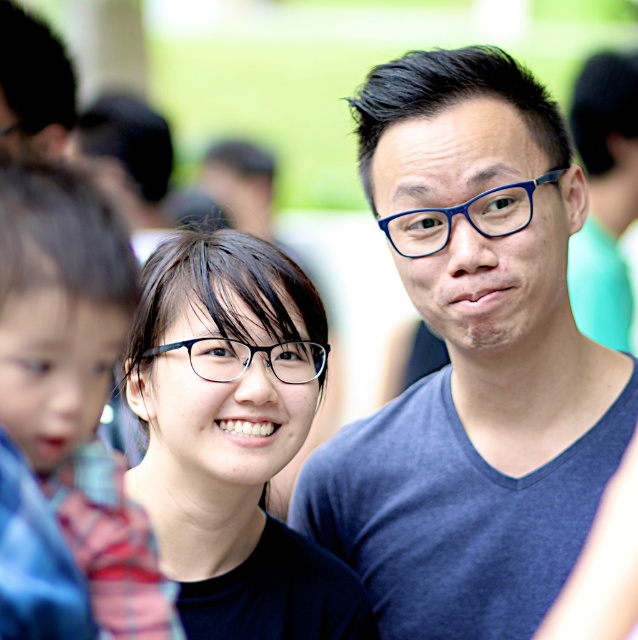
Can you confirm if blue matte shirt at center is positioned to the left of clear plastic glasses at center?

In fact, blue matte shirt at center is to the right of clear plastic glasses at center.

Does blue matte shirt at center have a smaller size compared to clear plastic glasses at center?

No, blue matte shirt at center is not smaller than clear plastic glasses at center.

This screenshot has height=640, width=638. What are the coordinates of `blue matte shirt at center` in the screenshot? It's located at (473, 362).

Is blue matte shirt at center above blue plastic glasses at center?

Incorrect, blue matte shirt at center is not positioned above blue plastic glasses at center.

Which is more to the left, blue matte shirt at center or blue plastic glasses at center?

blue matte shirt at center

Who is more forward, (538, 403) or (449, 225)?

Point (449, 225) is more forward.

The height and width of the screenshot is (640, 638). In order to click on blue matte shirt at center in this screenshot , I will do `click(473, 362)`.

This screenshot has width=638, height=640. What do you see at coordinates (232, 440) in the screenshot?
I see `black matte glasses at center` at bounding box center [232, 440].

Can you confirm if black matte glasses at center is positioned below blue plastic glasses at center?

Correct, black matte glasses at center is located below blue plastic glasses at center.

Does point (214, 573) come closer to viewer compared to point (505, 186)?

No, (214, 573) is behind (505, 186).

Image resolution: width=638 pixels, height=640 pixels. Find the location of `black matte glasses at center`. black matte glasses at center is located at coordinates (232, 440).